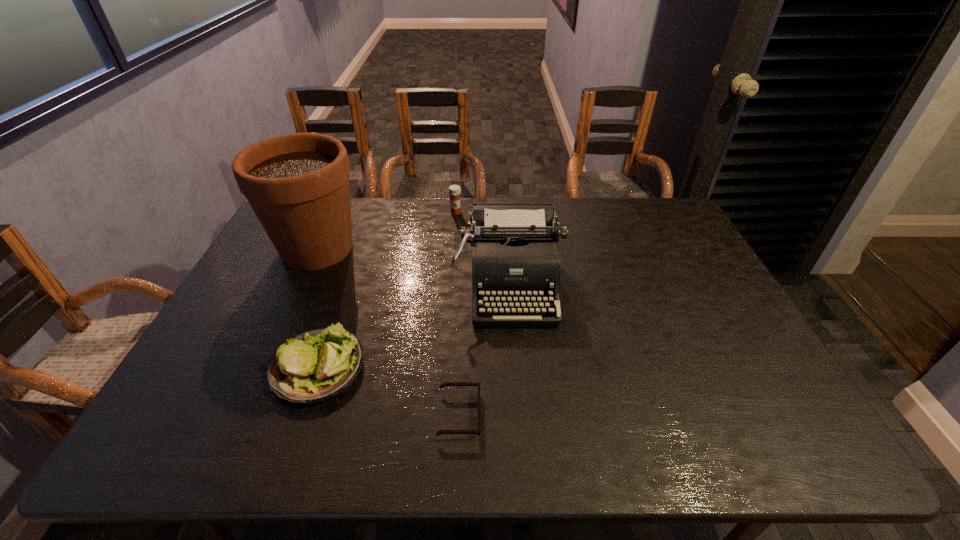
Locate an element on the screen. the tallest object is located at coordinates (297, 184).

Locate an element on the screen. The height and width of the screenshot is (540, 960). the second tallest object is located at coordinates (515, 259).

The height and width of the screenshot is (540, 960). Find the location of `the farthest object`. the farthest object is located at coordinates (454, 190).

Find the location of a particular element. medicine is located at coordinates (454, 190).

Image resolution: width=960 pixels, height=540 pixels. I want to click on lettuce, so click(317, 365).

The width and height of the screenshot is (960, 540). Identify the location of the shortest object. (442, 385).

You are a GUI agent. You are given a task and a screenshot of the screen. Output one action in this format:
    pyautogui.click(x=<x>, y=<y>)
    Task: Click on the vacant space situated 0.150m on the front of the tallest object
    
    Given the screenshot: What is the action you would take?
    pyautogui.click(x=287, y=315)

The height and width of the screenshot is (540, 960). In order to click on vacant space located 0.170m on the front-facing side of the typewriter in this screenshot , I will do `click(516, 382)`.

The width and height of the screenshot is (960, 540). In order to click on free space located 0.170m on the label side of the third shortest object in this screenshot , I will do `click(453, 244)`.

Locate an element on the screen. free location located 0.390m on the right of the second shortest object is located at coordinates (522, 367).